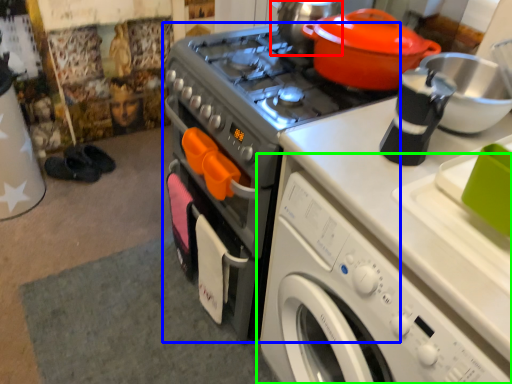
Question: Which object is positioned farthest from tea pot (highlighted by a red box)? Select from home appliance (highlighted by a blue box) and washing machine (highlighted by a green box).

Choices:
 (A) home appliance
 (B) washing machine

Answer: (B)